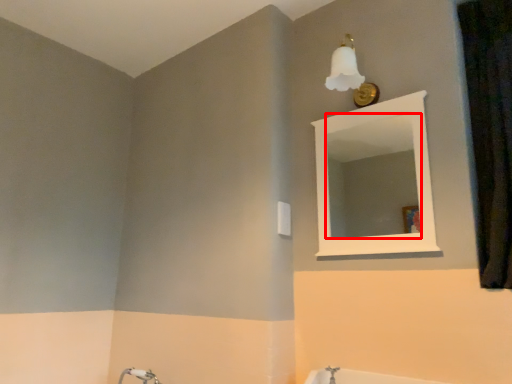
Question: Where is mirror (annotated by the red box) located in relation to curtain in the image?

Choices:
 (A) right
 (B) left

Answer: (B)